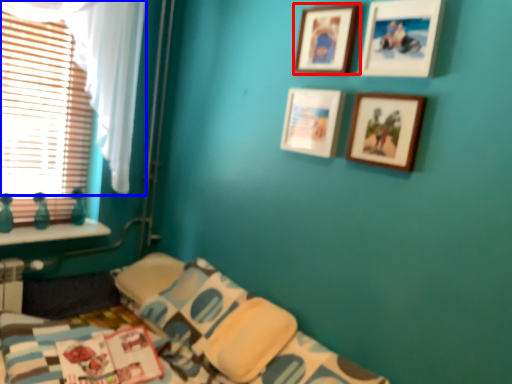
Question: Among these objects, which one is nearest to the camera, picture frame (highlighted by a red box) or curtain (highlighted by a blue box)?

Choices:
 (A) picture frame
 (B) curtain

Answer: (A)